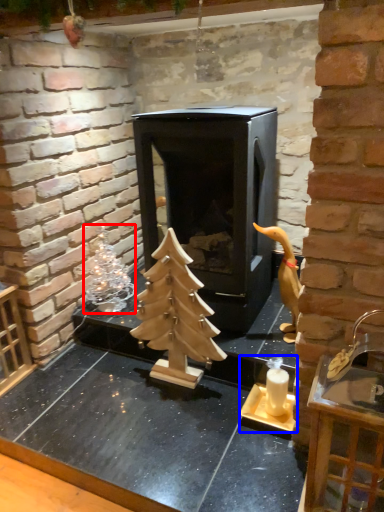
Question: Which object is further to the camera taking this photo, christmas decoration (highlighted by a red box) or candle holder (highlighted by a blue box)?

Choices:
 (A) christmas decoration
 (B) candle holder

Answer: (A)